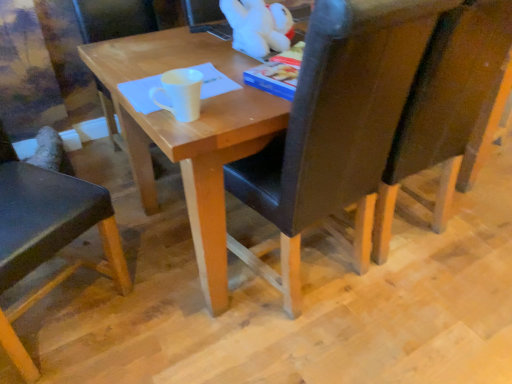
You are a GUI agent. You are given a task and a screenshot of the screen. Output one action in this format:
    pyautogui.click(x=<x>, y=<y>)
    Task: Click on the free space to the right of black leather chair at center, the third chair viewed from the left
    This screenshot has width=512, height=384.
    Given the screenshot: What is the action you would take?
    pyautogui.click(x=456, y=306)